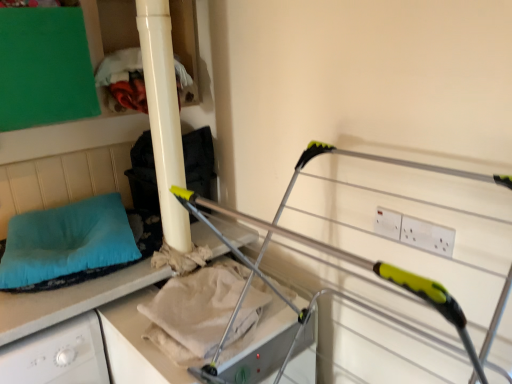
This screenshot has height=384, width=512. In order to click on free space below matte white pillar at upper left (from a real-world perspective) in this screenshot , I will do `click(180, 256)`.